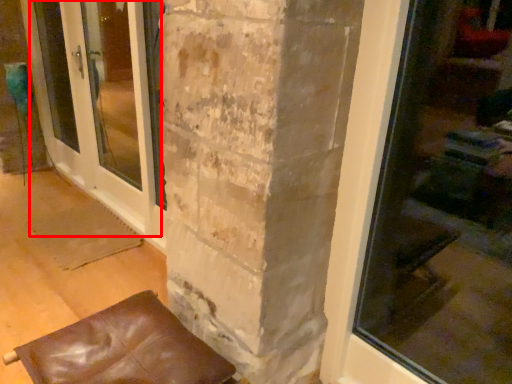
Question: From the image's perspective, what is the correct spatial relationship of screen door (annotated by the red box) in relation to furniture?

Choices:
 (A) below
 (B) above

Answer: (B)